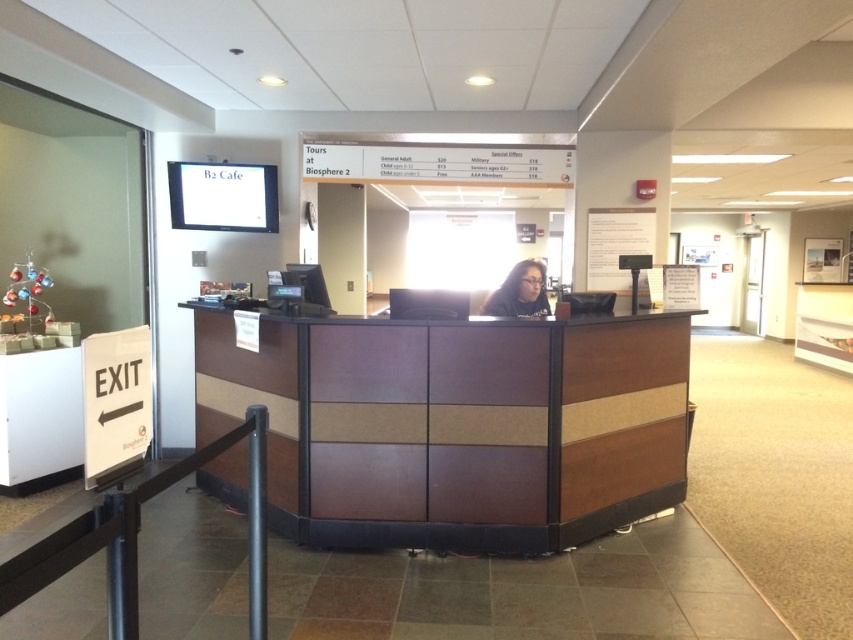
Who is lower down, brown wood/paneling information desk at center or black metal/rail at lower left?

brown wood/paneling information desk at center is lower down.

Is point (373, 536) positioned before point (262, 582)?

No, (373, 536) is further to viewer.

Which is in front, point (422, 496) or point (134, 563)?

Point (134, 563)

Identify the location of brown wood/paneling information desk at center. (456, 426).

Does point (624, 465) lie in front of point (535, 304)?

Yes.

This screenshot has width=853, height=640. Describe the element at coordinates (456, 426) in the screenshot. I see `brown wood/paneling information desk at center` at that location.

At what (x,y) coordinates should I click in order to perform the action: click on brown wood/paneling information desk at center. Please return your answer as a coordinate pair (x, y). The image size is (853, 640). Looking at the image, I should click on (456, 426).

Between black metal/rail at lower left and matte black hair at center, which one is positioned higher?

matte black hair at center is above.

Between black metal/rail at lower left and matte black hair at center, which one is positioned lower?

Positioned lower is black metal/rail at lower left.

You are a GUI agent. You are given a task and a screenshot of the screen. Output one action in this format:
    pyautogui.click(x=<x>, y=<y>)
    Task: Click on the black metal/rail at lower left
    
    Given the screenshot: What is the action you would take?
    pyautogui.click(x=136, y=538)